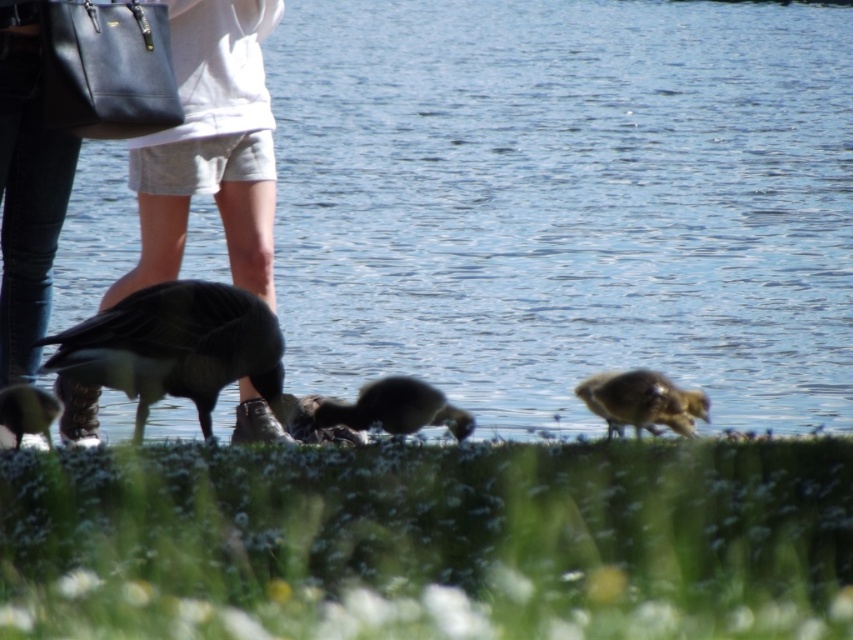
Based on the photo, can you confirm if clear blue water at center is positioned to the left of brown fuzzy duckling at lower right?

Correct, you'll find clear blue water at center to the left of brown fuzzy duckling at lower right.

Measure the distance between clear blue water at center and brown fuzzy duckling at lower right.

A distance of 4.06 meters exists between clear blue water at center and brown fuzzy duckling at lower right.

Find the location of a particular element. The width and height of the screenshot is (853, 640). clear blue water at center is located at coordinates (567, 202).

Who is more distant from viewer, (x=457, y=412) or (x=16, y=394)?

The point (x=457, y=412) is behind.

Which is more to the right, dark brown feathers at center or dark brown feathers at lower left?

From the viewer's perspective, dark brown feathers at center appears more on the right side.

Is point (352, 422) positioned in front of point (7, 406)?

That is False.

Where is `dark brown feathers at center`? dark brown feathers at center is located at coordinates (392, 408).

Is point (643, 424) more distant than point (19, 384)?

No, it is in front of (19, 384).

Which is in front, point (610, 426) or point (7, 426)?

Point (7, 426)

Locate an element on the screen. The width and height of the screenshot is (853, 640). brown fuzzy duckling at lower right is located at coordinates (643, 401).